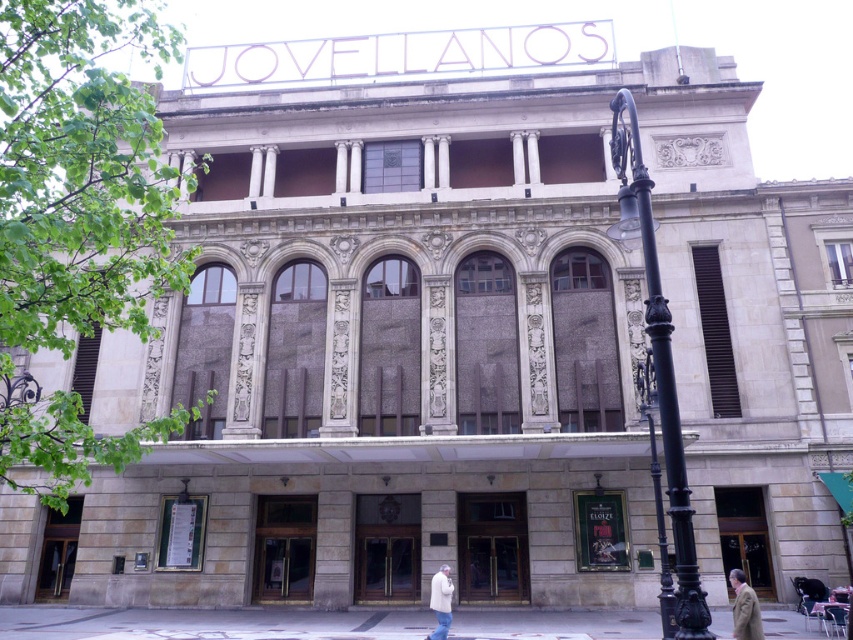
Question: Does brown wool coat at lower right have a larger size compared to white wool coat at lower center?

Choices:
 (A) yes
 (B) no

Answer: (A)

Question: Is smooth concrete pavement at lower center positioned in front of brown wool coat at lower right?

Choices:
 (A) yes
 (B) no

Answer: (B)

Question: Estimate the real-world distances between objects in this image. Which object is farther from the black wrought iron streetlight at right?

Choices:
 (A) brown wool coat at lower right
 (B) smooth concrete pavement at lower center
 (C) white wool coat at lower center

Answer: (B)

Question: Which of the following is the closest to the observer?

Choices:
 (A) white wool coat at lower center
 (B) smooth concrete pavement at lower center
 (C) black wrought iron streetlight at right

Answer: (C)

Question: From the image, what is the correct spatial relationship of brown wool coat at lower right in relation to white wool coat at lower center?

Choices:
 (A) right
 (B) left

Answer: (A)

Question: Which point is farther from the camera taking this photo?

Choices:
 (A) (663, 420)
 (B) (444, 616)

Answer: (B)